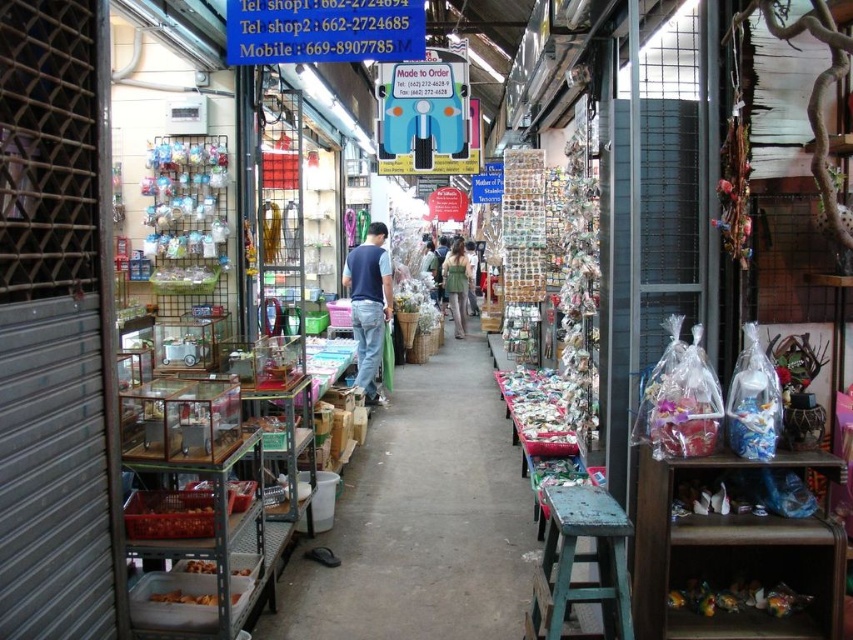
Question: Estimate the real-world distances between objects in this image. Which object is closer to the translucent plastic candy at center?

Choices:
 (A) wooden stool at center
 (B) translucent plastic food at lower right
 (C) translucent plastic food at lower left
 (D) navy blue vest at center

Answer: (D)

Question: Observing the image, what is the correct spatial positioning of navy blue vest at center in reference to green fabric dress at center?

Choices:
 (A) right
 (B) left

Answer: (B)

Question: Which of these objects is positioned closest to the navy blue vest at center?

Choices:
 (A) translucent plastic candy at center
 (B) metallic silver shelves at center
 (C) wooden stool at center
 (D) green fabric dress at center

Answer: (A)

Question: Does metallic silver shelves at center have a greater width compared to navy blue vest at center?

Choices:
 (A) no
 (B) yes

Answer: (B)

Question: Estimate the real-world distances between objects in this image. Which object is closer to the translucent plastic candy at center?

Choices:
 (A) navy blue vest at center
 (B) green fabric dress at center
 (C) translucent plastic food at lower left
 (D) metallic silver shelves at center

Answer: (D)

Question: From the image, what is the correct spatial relationship of green fabric dress at center in relation to translucent plastic food at lower left?

Choices:
 (A) right
 (B) left

Answer: (A)